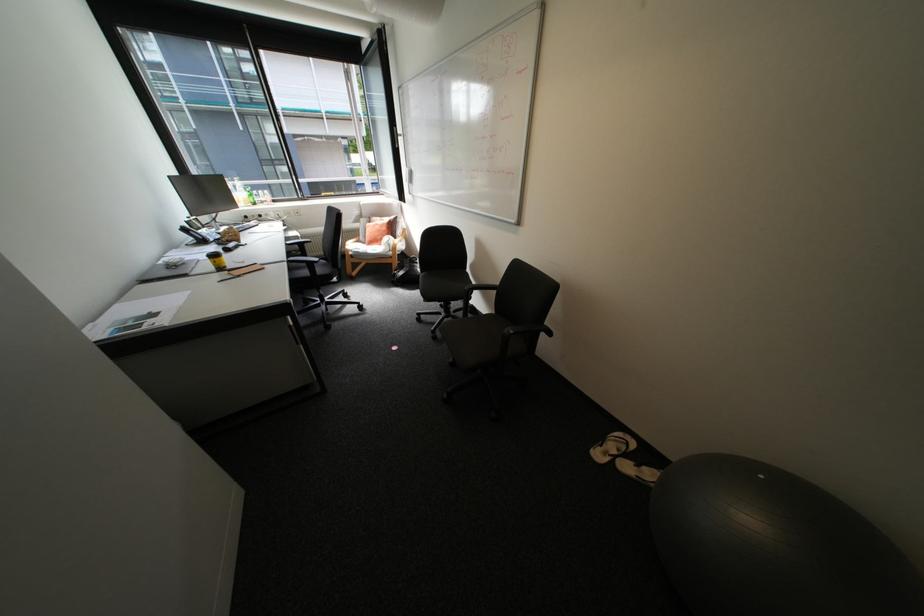
Where would you sit the chair sitting surface? Please return your answer as a coordinate pair (x, y).

(444, 284)